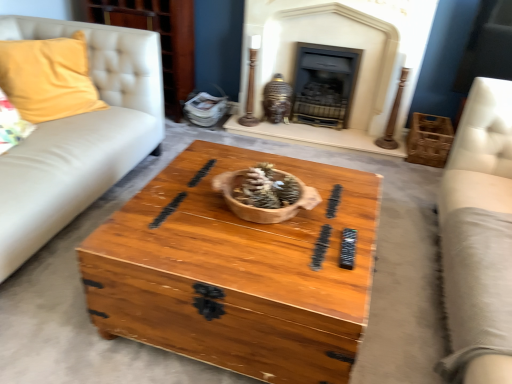
Looking at this image, what is the approximate width of dark gray stone fireplace at center, which appears as the second fireplace when viewed from the left?

The width of dark gray stone fireplace at center, which appears as the second fireplace when viewed from the left, is 8.52 inches.

Find the location of a particular element. The width and height of the screenshot is (512, 384). matte black fireplace at upper center, which is the first fireplace in left-to-right order is located at coordinates (340, 46).

The image size is (512, 384). What do you see at coordinates (340, 46) in the screenshot?
I see `matte black fireplace at upper center, which is the first fireplace in left-to-right order` at bounding box center [340, 46].

This screenshot has width=512, height=384. I want to click on dark gray stone fireplace at center, the first fireplace when ordered from right to left, so click(324, 84).

Is yellow fabric pillow at left not near wooden chest at center?

Yes, yellow fabric pillow at left is far from wooden chest at center.

Can you confirm if yellow fabric pillow at left is thinner than wooden chest at center?

Yes.

Which is closer to the camera, (86, 47) or (350, 342)?

Positioned in front is point (350, 342).

From a real-world perspective, which object rests below the other?

Result: In real-world perspective, wooden chest at center is lower.

From a real-world perspective, does dark gray stone fireplace at center, the first fireplace when ordered from right to left, sit lower than wooden crate at right?

No.

Between dark gray stone fireplace at center, the first fireplace when ordered from right to left, and wooden crate at right, which one has more height?

With more height is dark gray stone fireplace at center, the first fireplace when ordered from right to left.

From the picture: Can you confirm if dark gray stone fireplace at center, which appears as the second fireplace when viewed from the left, is thinner than wooden crate at right?

Yes.

From the image's perspective, which is below, dark gray stone fireplace at center, the first fireplace when ordered from right to left, or wooden crate at right?

From the image's view, wooden crate at right is below.

Does dark gray stone fireplace at center, which appears as the second fireplace when viewed from the left, appear on the left side of matte white dresser at upper left?

Incorrect, dark gray stone fireplace at center, which appears as the second fireplace when viewed from the left, is not on the left side of matte white dresser at upper left.

Is dark gray stone fireplace at center, the first fireplace when ordered from right to left, next to matte white dresser at upper left?

There is a gap between dark gray stone fireplace at center, the first fireplace when ordered from right to left, and matte white dresser at upper left.

From the image's perspective, would you say dark gray stone fireplace at center, the first fireplace when ordered from right to left, is positioned over matte white dresser at upper left?

No, from the image's perspective, dark gray stone fireplace at center, the first fireplace when ordered from right to left, is not over matte white dresser at upper left.

Between matte white dresser at upper left and dark gray stone fireplace at center, which appears as the second fireplace when viewed from the left, which one has less height?

Standing shorter between the two is dark gray stone fireplace at center, which appears as the second fireplace when viewed from the left.

Where is `dresser above the dark gray stone fireplace at center, which appears as the second fireplace when viewed from the left (from a real-world perspective)`? This screenshot has height=384, width=512. dresser above the dark gray stone fireplace at center, which appears as the second fireplace when viewed from the left (from a real-world perspective) is located at coordinates (160, 36).

Who is more distant, matte white dresser at upper left or dark gray stone fireplace at center, the first fireplace when ordered from right to left?

dark gray stone fireplace at center, the first fireplace when ordered from right to left.

Is wooden chest at center completely or partially outside of matte black fireplace at upper center, which is the first fireplace in left-to-right order?

wooden chest at center lies outside matte black fireplace at upper center, which is the first fireplace in left-to-right order,'s area.

Is point (254, 258) behind point (431, 14)?

No, it is not.

Can you confirm if wooden chest at center is positioned to the left of matte black fireplace at upper center, the second fireplace from the right?

Yes.

Which object is further away from the camera taking this photo, wooden chest at center or matte black fireplace at upper center, the second fireplace from the right?

matte black fireplace at upper center, the second fireplace from the right, is more distant.

Can you tell me how much matte black fireplace at upper center, which is the first fireplace in left-to-right order, and wooden crate at right differ in facing direction?

The facing directions of matte black fireplace at upper center, which is the first fireplace in left-to-right order, and wooden crate at right are 0.000508 degrees apart.

From a real-world perspective, which object rests below the other?

From a 3D spatial view, wooden crate at right is below.

Identify the location of the 2nd fireplace directly above the wooden crate at right (from a real-world perspective). This screenshot has width=512, height=384. (340, 46).

How distant is matte black fireplace at upper center, which is the first fireplace in left-to-right order, from wooden crate at right?

They are 21.14 inches apart.

From the image's perspective, does wooden crate at right appear lower than dark gray stone fireplace at center, the first fireplace when ordered from right to left?

Yes.

Who is shorter, wooden crate at right or dark gray stone fireplace at center, the first fireplace when ordered from right to left?

With less height is wooden crate at right.

Is wooden crate at right smaller than dark gray stone fireplace at center, the first fireplace when ordered from right to left?

Yes.

Is wooden crate at right in front of or behind dark gray stone fireplace at center, which appears as the second fireplace when viewed from the left, in the image?

wooden crate at right is in front of dark gray stone fireplace at center, which appears as the second fireplace when viewed from the left.

At what (x,y) coordinates should I click in order to perform the action: click on coffee table lying in front of the yellow fabric pillow at left. Please return your answer as a coordinate pair (x, y). Looking at the image, I should click on (234, 272).

Find the location of a particular element. The height and width of the screenshot is (384, 512). crate that is below the dark gray stone fireplace at center, which appears as the second fireplace when viewed from the left (from the image's perspective) is located at coordinates (429, 140).

Estimate the real-world distances between objects in this image. Which object is further from light beige leather couch at right, wooden crate at right or matte black fireplace at upper center, the second fireplace from the right?

matte black fireplace at upper center, the second fireplace from the right, is positioned further to the anchor light beige leather couch at right.

When comparing their distances from matte black fireplace at upper center, which is the first fireplace in left-to-right order, does wooden crate at right or light beige leather couch at right seem further?

light beige leather couch at right.

From the image, which object appears to be farther from matte white dresser at upper left, light beige leather couch at right or wooden crate at right?

light beige leather couch at right is positioned further to the anchor matte white dresser at upper left.

Which object lies nearer to the anchor point matte white dresser at upper left, dark gray stone fireplace at center, which appears as the second fireplace when viewed from the left, or matte black fireplace at upper center, the second fireplace from the right?

matte black fireplace at upper center, the second fireplace from the right, lies closer to matte white dresser at upper left than the other object.

From the image, which object appears to be nearer to yellow fabric pillow at left, matte black fireplace at upper center, the second fireplace from the right, or matte white dresser at upper left?

matte white dresser at upper left is positioned closer to the anchor yellow fabric pillow at left.

Considering their positions, is yellow fabric pillow at left positioned further to matte black fireplace at upper center, which is the first fireplace in left-to-right order, than matte white dresser at upper left?

Based on the image, yellow fabric pillow at left appears to be further to matte black fireplace at upper center, which is the first fireplace in left-to-right order.

Looking at the image, which one is located closer to dark gray stone fireplace at center, the first fireplace when ordered from right to left, yellow fabric pillow at left or matte black fireplace at upper center, which is the first fireplace in left-to-right order?

The object closer to dark gray stone fireplace at center, the first fireplace when ordered from right to left, is matte black fireplace at upper center, which is the first fireplace in left-to-right order.

Looking at the image, which one is located closer to dark gray stone fireplace at center, the first fireplace when ordered from right to left, matte white dresser at upper left or light beige leather couch at right?

matte white dresser at upper left is positioned closer to the anchor dark gray stone fireplace at center, the first fireplace when ordered from right to left.

The image size is (512, 384). Identify the location of fireplace between matte black fireplace at upper center, the second fireplace from the right, and wooden crate at right. (324, 84).

The image size is (512, 384). I want to click on coffee table between yellow fabric pillow at left and wooden crate at right from left to right, so click(234, 272).

Where is `fireplace located between light beige leather couch at right and wooden crate at right in the depth direction`? fireplace located between light beige leather couch at right and wooden crate at right in the depth direction is located at coordinates (340, 46).

At what (x,y) coordinates should I click in order to perform the action: click on fireplace located between wooden chest at center and dark gray stone fireplace at center, which appears as the second fireplace when viewed from the left, in the depth direction. Please return your answer as a coordinate pair (x, y). The image size is (512, 384). Looking at the image, I should click on 340,46.